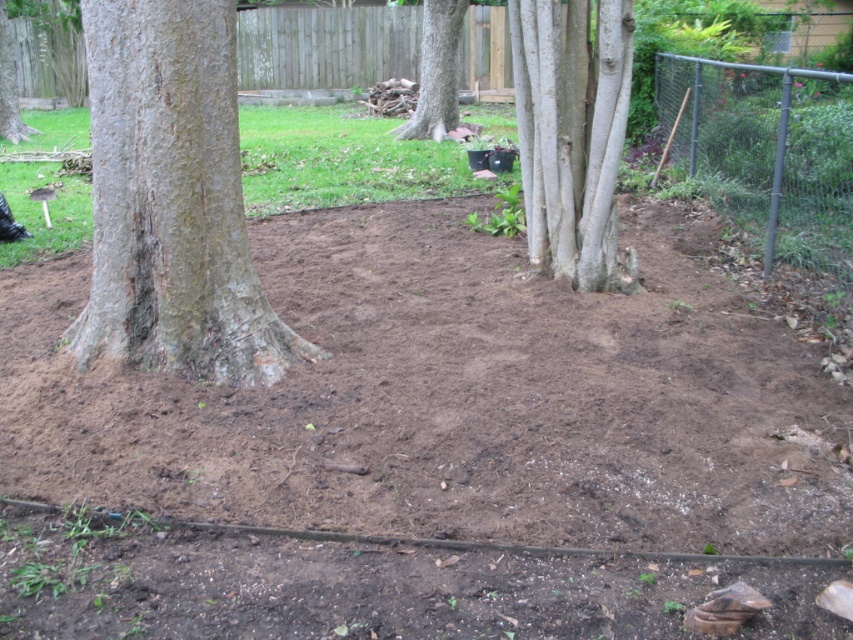
Question: Is smooth bark tree at left wider than smooth gray bark at center?

Choices:
 (A) no
 (B) yes

Answer: (B)

Question: Which of the following is the farthest from the observer?

Choices:
 (A) (10, 74)
 (B) (236, 243)
 (C) (846, 124)
 (D) (596, 276)

Answer: (A)

Question: Can you confirm if smooth gray bark at center is smaller than brown rough bark tree at left?

Choices:
 (A) yes
 (B) no

Answer: (A)

Question: Which point appears closest to the camera in this image?

Choices:
 (A) [x=3, y=100]
 (B) [x=587, y=83]
 (C) [x=734, y=99]

Answer: (B)

Question: Which is farther from the brown rough bark tree at left?

Choices:
 (A) smooth gray bark at center
 (B) brown rough tree at center
 (C) brown soil at center
 (D) metallic chain-link fence at upper right

Answer: (A)

Question: Considering the relative positions of smooth bark tree at left and brown rough tree at center in the image provided, where is smooth bark tree at left located with respect to brown rough tree at center?

Choices:
 (A) right
 (B) left

Answer: (B)